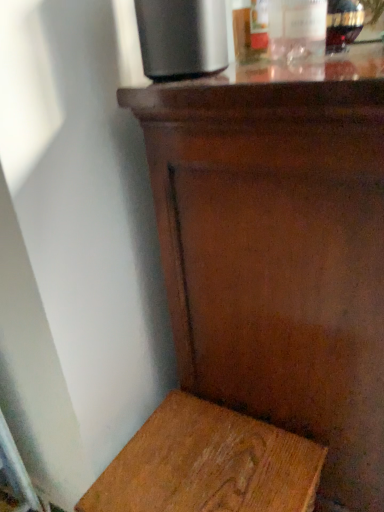
Question: Should I look upward or downward to see translucent glass bottle at upper right, which ranks as the second bottle in left-to-right order?

Choices:
 (A) down
 (B) up

Answer: (B)

Question: Is translucent glass bottle at upper right, which ranks as the second bottle in left-to-right order, turned away from wooden stool at lower left?

Choices:
 (A) no
 (B) yes

Answer: (A)

Question: Can we say translucent glass bottle at upper right, which ranks as the second bottle in left-to-right order, lies outside wooden stool at lower left?

Choices:
 (A) no
 (B) yes

Answer: (B)

Question: Does translucent glass bottle at upper right, which ranks as the second bottle in left-to-right order, have a smaller size compared to wooden stool at lower left?

Choices:
 (A) no
 (B) yes

Answer: (B)

Question: Is translucent glass bottle at upper right, which ranks as the second bottle in left-to-right order, with wooden stool at lower left?

Choices:
 (A) yes
 (B) no

Answer: (B)

Question: Would you say wooden stool at lower left is part of translucent glass bottle at upper right, the 1th bottle when ordered from right to left,'s contents?

Choices:
 (A) yes
 (B) no

Answer: (B)

Question: Is translucent glass bottle at upper right, the 1th bottle when ordered from right to left, oriented towards wooden stool at lower left?

Choices:
 (A) no
 (B) yes

Answer: (A)

Question: Can you confirm if shiny brown wood table at center is shorter than wooden stool at lower left?

Choices:
 (A) yes
 (B) no

Answer: (B)

Question: Considering the relative positions of shiny brown wood table at center and wooden stool at lower left in the image provided, is shiny brown wood table at center to the right of wooden stool at lower left from the viewer's perspective?

Choices:
 (A) no
 (B) yes

Answer: (B)

Question: Is wooden stool at lower left at the back of shiny brown wood table at center?

Choices:
 (A) yes
 (B) no

Answer: (B)

Question: From the image's perspective, is shiny brown wood table at center below wooden stool at lower left?

Choices:
 (A) no
 (B) yes

Answer: (A)

Question: Is shiny brown wood table at center positioned far away from wooden stool at lower left?

Choices:
 (A) yes
 (B) no

Answer: (B)

Question: Is shiny brown wood table at center completely or partially outside of wooden stool at lower left?

Choices:
 (A) no
 (B) yes

Answer: (B)

Question: Would you say clear glass bottle at upper right, marked as the first bottle in a left-to-right arrangement, contains wooden stool at lower left?

Choices:
 (A) no
 (B) yes

Answer: (A)